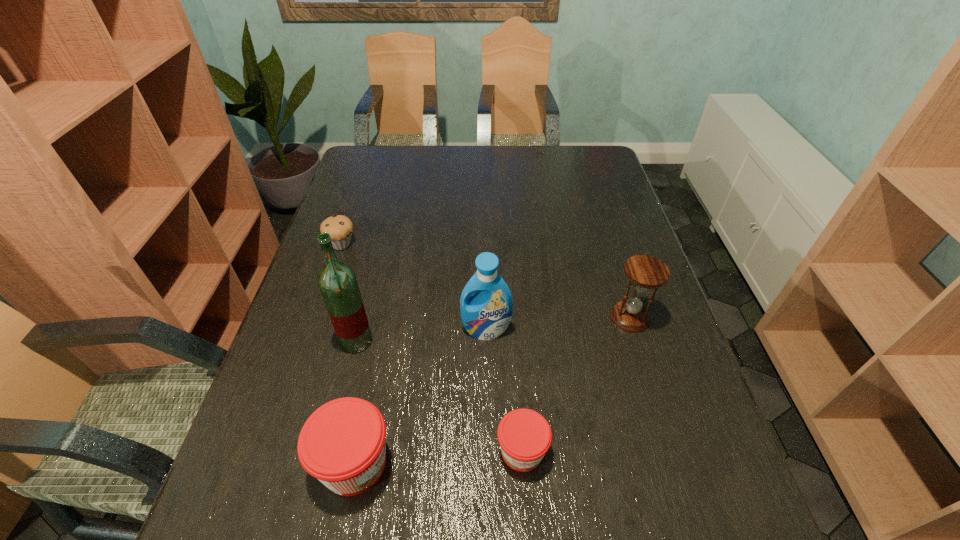
The jams are evenly distributed in the image. To maintain this, where would you place another jam on the right? Please point to a free space. Please provide its 2D coordinates. Your answer should be formatted as a tuple, i.e. [(x, y)], where the tuple contains the x and y coordinates of a point satisfying the conditions above.

[(684, 440)]